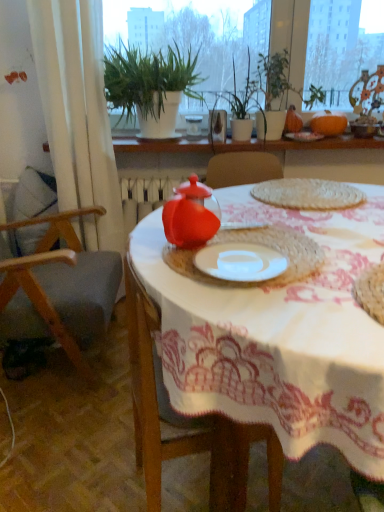
You are a GUI agent. You are given a task and a screenshot of the screen. Output one action in this format:
    pyautogui.click(x=<x>, y=<y>)
    Task: Click on the vacant space that is in between white matte plate at center and woven mat at center
    This screenshot has height=512, width=384.
    Given the screenshot: What is the action you would take?
    pyautogui.click(x=292, y=225)